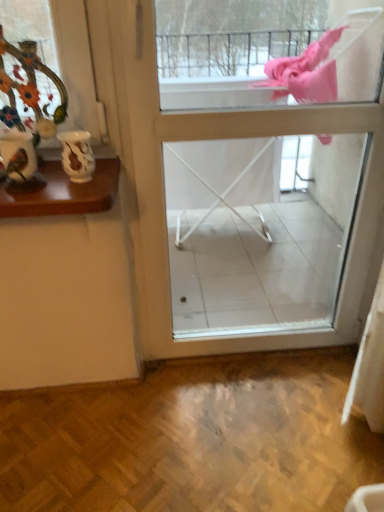
Question: Considering the relative sizes of porcelain vase at upper left and white glossy vase at upper left in the image provided, is porcelain vase at upper left bigger than white glossy vase at upper left?

Choices:
 (A) no
 (B) yes

Answer: (B)

Question: Can you confirm if porcelain vase at upper left is positioned to the left of white glossy vase at upper left?

Choices:
 (A) yes
 (B) no

Answer: (A)

Question: Is porcelain vase at upper left outside white glossy vase at upper left?

Choices:
 (A) yes
 (B) no

Answer: (A)

Question: Is porcelain vase at upper left wider than white glossy vase at upper left?

Choices:
 (A) no
 (B) yes

Answer: (A)

Question: Is porcelain vase at upper left facing away from white glossy vase at upper left?

Choices:
 (A) no
 (B) yes

Answer: (A)

Question: From a real-world perspective, relative to white glossy vase at upper left, is porcelain vase at upper left vertically above or below?

Choices:
 (A) below
 (B) above

Answer: (B)

Question: Relative to white glossy vase at upper left, is porcelain vase at upper left in front or behind?

Choices:
 (A) behind
 (B) front

Answer: (B)

Question: From their relative heights in the image, would you say porcelain vase at upper left is taller or shorter than white glossy vase at upper left?

Choices:
 (A) tall
 (B) short

Answer: (A)

Question: Considering the positions of point (28, 84) and point (74, 147), is point (28, 84) closer or farther from the camera than point (74, 147)?

Choices:
 (A) closer
 (B) farther

Answer: (A)

Question: From a real-world perspective, is white glossy vase at upper left above or below white glossy screen door at center?

Choices:
 (A) below
 (B) above

Answer: (B)

Question: Is white glossy vase at upper left in front of or behind white glossy screen door at center in the image?

Choices:
 (A) behind
 (B) front

Answer: (A)

Question: Is white glossy vase at upper left taller or shorter than white glossy screen door at center?

Choices:
 (A) short
 (B) tall

Answer: (A)

Question: From the image's perspective, relative to white glossy screen door at center, is white glossy vase at upper left above or below?

Choices:
 (A) below
 (B) above

Answer: (B)

Question: In terms of size, does white glossy screen door at center appear bigger or smaller than white glossy vase at upper left?

Choices:
 (A) big
 (B) small

Answer: (A)

Question: From the image's perspective, is white glossy screen door at center above or below white glossy vase at upper left?

Choices:
 (A) above
 (B) below

Answer: (B)